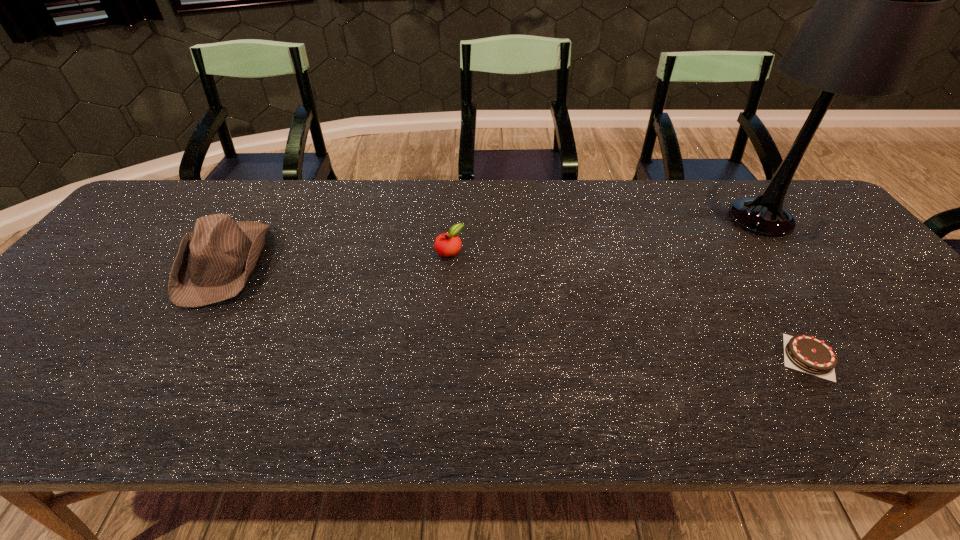
Where is `free space located 0.400m on the left of the chocolate cake`? free space located 0.400m on the left of the chocolate cake is located at coordinates (596, 357).

Find the location of a particular element. Image resolution: width=960 pixels, height=540 pixels. table lamp located at the far edge is located at coordinates (878, 0).

Locate an element on the screen. The image size is (960, 540). fedora that is at the far edge is located at coordinates (214, 262).

Identify the location of object that is at the right edge. This screenshot has height=540, width=960. (878, 0).

This screenshot has width=960, height=540. I want to click on object at the far right corner, so click(x=878, y=0).

The height and width of the screenshot is (540, 960). What are the coordinates of `vacant region at the far edge of the desktop` in the screenshot? It's located at (394, 219).

Identify the location of vacant space at the near edge of the desktop. The width and height of the screenshot is (960, 540). (110, 405).

Identify the location of free space at the right edge of the desktop. The height and width of the screenshot is (540, 960). (845, 235).

At what (x,y) coordinates should I click in order to perform the action: click on free space at the far right corner of the desktop. Please return your answer as a coordinate pair (x, y). Looking at the image, I should click on (768, 181).

Find the location of a particular element. vacant space at the near right corner of the desktop is located at coordinates (943, 396).